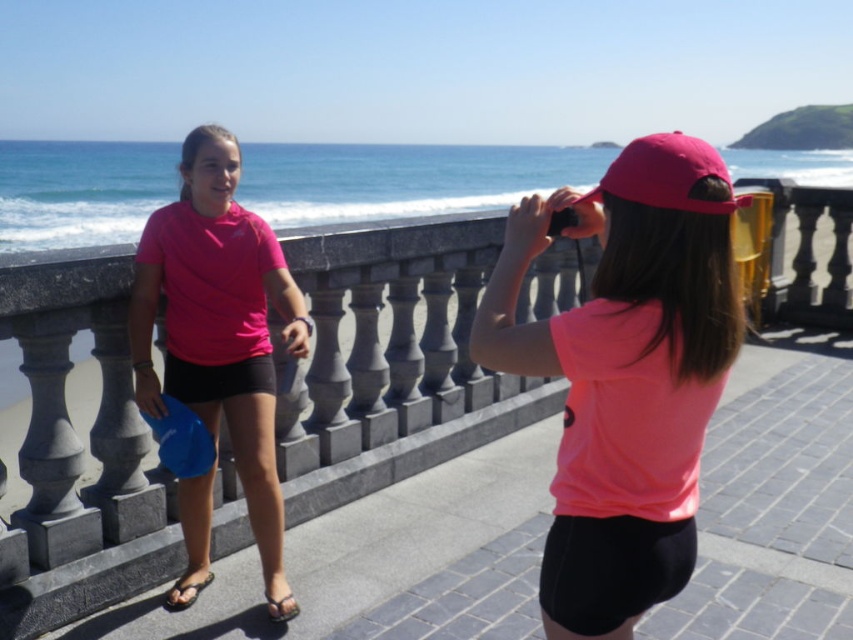
I want to click on pink matte shirt at center, so click(x=625, y=372).

Who is more distant from viewer, (665, 556) or (213, 355)?

The point (213, 355) is more distant.

This screenshot has height=640, width=853. In order to click on pink matte shirt at center in this screenshot , I will do `click(625, 372)`.